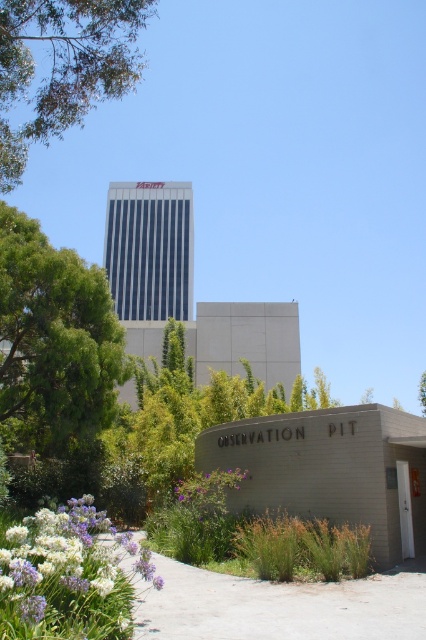
Question: Estimate the real-world distances between objects in this image. Which object is closer to the green leafy tree at upper center?

Choices:
 (A) green leafy tree at left
 (B) white matte flowers at lower left
 (C) purple matte flower at lower center

Answer: (B)

Question: Does green leafy tree at left have a smaller size compared to green leafy tree at upper center?

Choices:
 (A) no
 (B) yes

Answer: (A)

Question: Among these objects, which one is farthest from the camera?

Choices:
 (A) purple matte flower at lower center
 (B) green leafy tree at left

Answer: (B)

Question: Can you confirm if green leafy tree at left is positioned to the left of green leafy tree at upper center?

Choices:
 (A) yes
 (B) no

Answer: (A)

Question: Which point appears closest to the camera in this image?

Choices:
 (A) (25, 560)
 (B) (121, 44)
 (C) (108, 333)

Answer: (A)

Question: Is green leafy tree at left further to the viewer compared to white matte flowers at lower left?

Choices:
 (A) no
 (B) yes

Answer: (B)